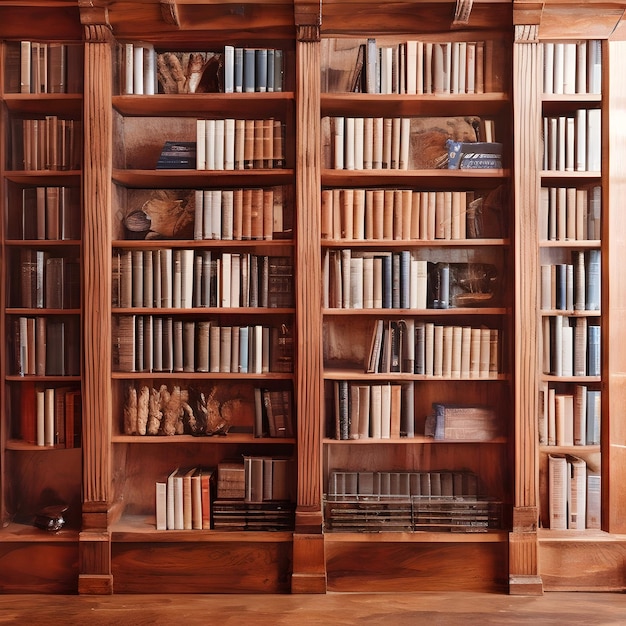
Where is `the top shelf`? the top shelf is located at coordinates (29, 95), (188, 98), (432, 95), (568, 98).